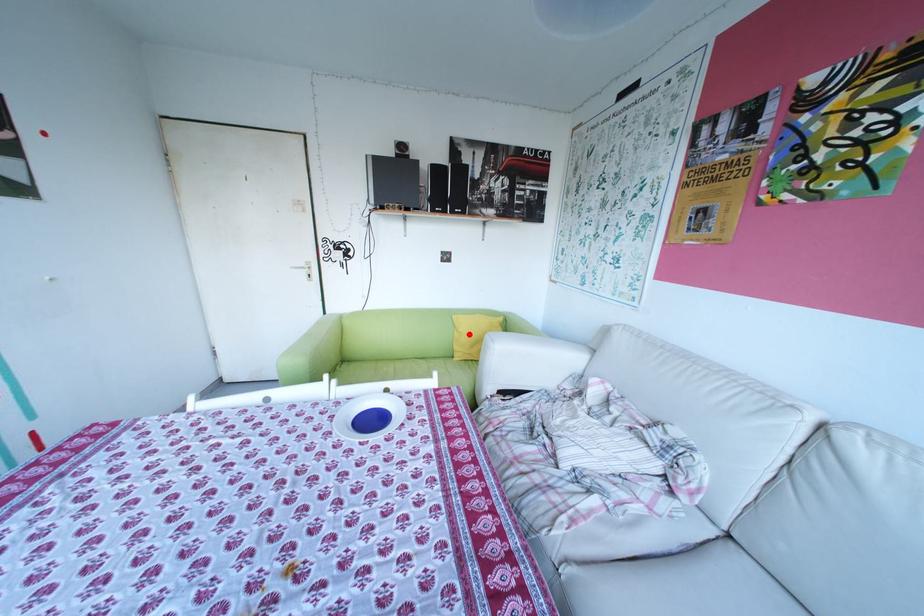
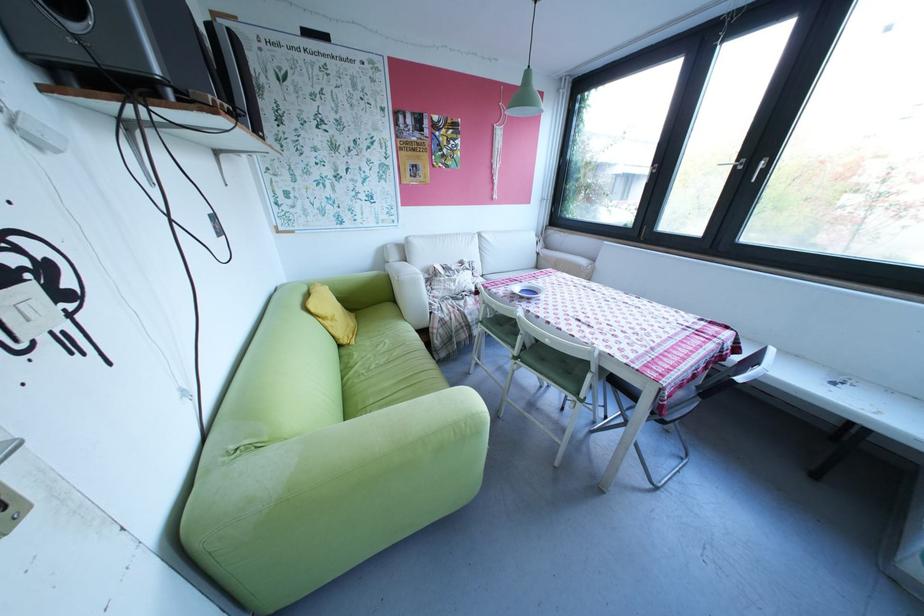
Question: I am providing you with two images of the same scene from different viewpoints. Image1 has a red point marked. In image2, the corresponding 3D location appears at what relative position? Reply with the corresponding letter.

Choices:
 (A) Closer
 (B) Farther

Answer: (A)